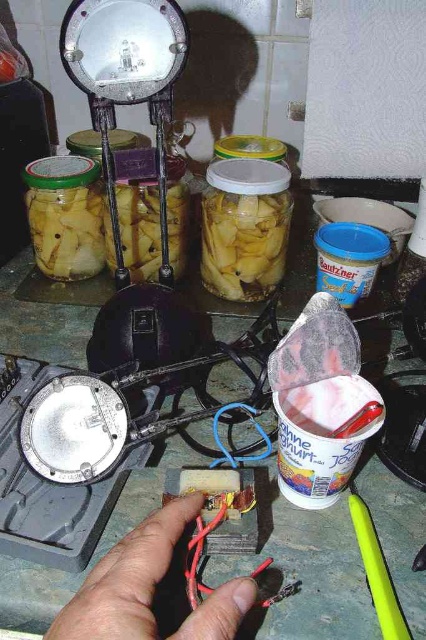
The height and width of the screenshot is (640, 426). What are the coordinates of `skinny flesh-toned hand at lower center` in the screenshot? It's located at (127, 579).

Between point (175, 524) and point (259, 246), which one is positioned in front?

Point (175, 524) is more forward.

The width and height of the screenshot is (426, 640). Describe the element at coordinates (127, 579) in the screenshot. I see `skinny flesh-toned hand at lower center` at that location.

The image size is (426, 640). I want to click on skinny flesh-toned hand at lower center, so click(x=127, y=579).